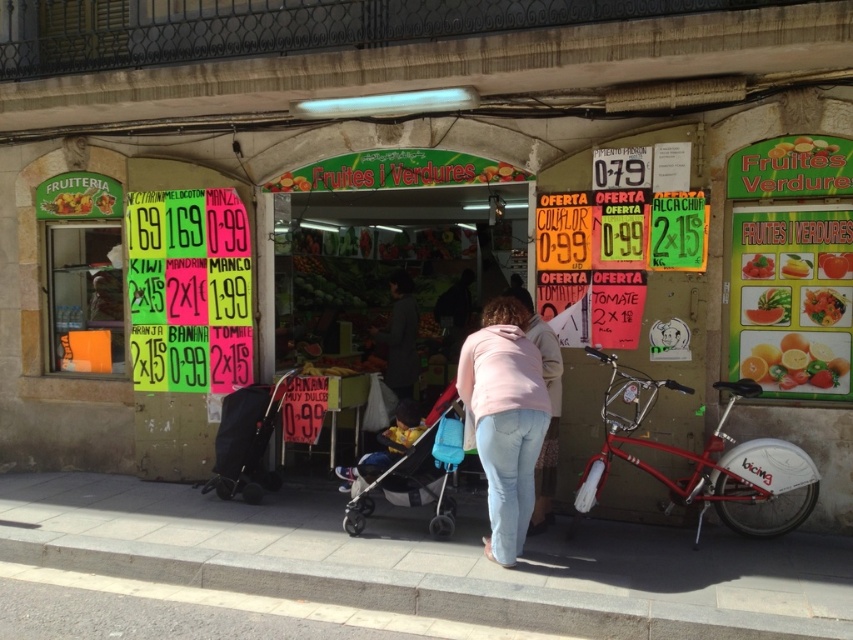
Question: Among these objects, which one is nearest to the camera?

Choices:
 (A) green matte tomato at center
 (B) smooth orange melon at center
 (C) smooth tomato at center
 (D) smooth concrete pavement at lower center

Answer: (B)

Question: Can you confirm if smooth concrete pavement at lower center is thinner than green matte tomato at center?

Choices:
 (A) no
 (B) yes

Answer: (A)

Question: Which point is farther to the camera?

Choices:
 (A) pink fabric jacket at center
 (B) smooth orange melon at center
 (C) light pink fabric jacket at center
 (D) blue fabric stroller at center

Answer: (C)

Question: Estimate the real-world distances between objects in this image. Which object is closer to the smooth concrete pavement at lower center?

Choices:
 (A) light pink fabric jacket at center
 (B) smooth tomato at center
 (C) green matte tomato at center
 (D) smooth orange melon at center

Answer: (A)

Question: Is light pink fabric jacket at center wider than yellow smooth tomato at center?

Choices:
 (A) yes
 (B) no

Answer: (A)

Question: Is pink fleece jacket at center in front of yellow smooth tomato at center?

Choices:
 (A) yes
 (B) no

Answer: (A)